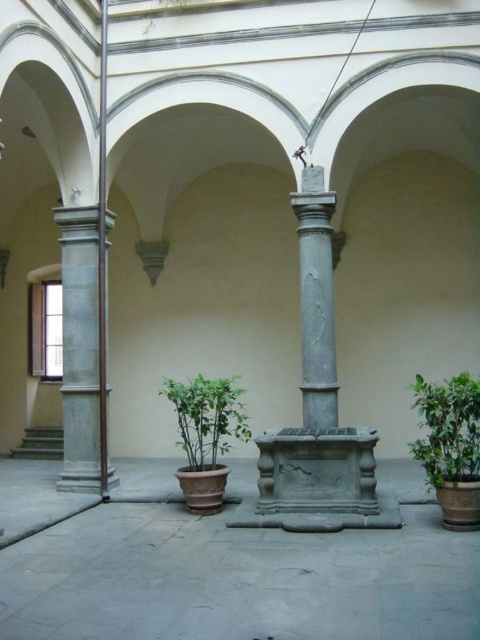
Between gray stone column at left and gray stone column at center, which one appears on the left side from the viewer's perspective?

gray stone column at left is more to the left.

Does point (93, 332) come behind point (309, 348)?

Yes.

Does point (84, 364) lie behind point (330, 371)?

Yes, point (84, 364) is behind point (330, 371).

The width and height of the screenshot is (480, 640). Find the location of `gray stone column at left`. gray stone column at left is located at coordinates (80, 348).

Is gray stone column at left bigger than green matte pot at center?

Yes.

What are the coordinates of `gray stone column at left` in the screenshot? It's located at (80, 348).

Between point (71, 228) and point (203, 416), which one is positioned behind?

The point (71, 228) is more distant.

Where is `gray stone column at left`? The image size is (480, 640). gray stone column at left is located at coordinates (80, 348).

Between gray stone column at center and green matte pot at center, which one appears on the right side from the viewer's perspective?

Positioned to the right is gray stone column at center.

I want to click on gray stone column at center, so click(315, 300).